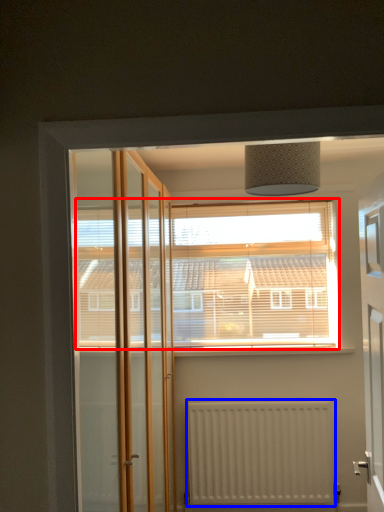
Question: Which object is closer to the camera taking this photo, window (highlighted by a red box) or radiator (highlighted by a blue box)?

Choices:
 (A) window
 (B) radiator

Answer: (B)